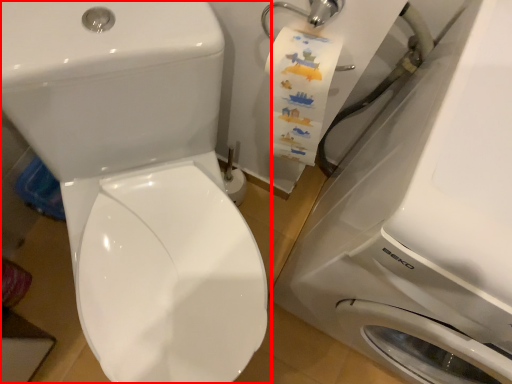
Question: Considering the relative positions of toilet (annotated by the red box) and washing machine in the image provided, where is toilet (annotated by the red box) located with respect to the staircase?

Choices:
 (A) left
 (B) right

Answer: (A)